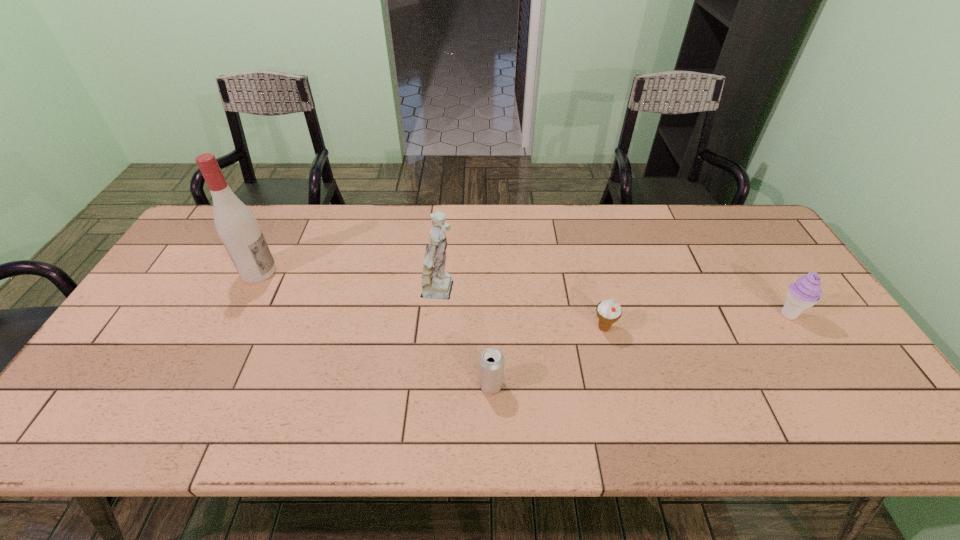
You are a GUI agent. You are given a task and a screenshot of the screen. Output one action in this format:
    pyautogui.click(x=<x>, y=<y>)
    Task: Click on the alcohol
    
    Given the screenshot: What is the action you would take?
    pyautogui.click(x=236, y=225)

At what (x,y) coordinates should I click in order to perform the action: click on the tallest object. Please return your answer as a coordinate pair (x, y). Looking at the image, I should click on (236, 225).

Locate an element on the screen. This screenshot has width=960, height=540. the fourth object from right to left is located at coordinates (437, 284).

Find the location of `figurine`. figurine is located at coordinates (437, 284).

The image size is (960, 540). I want to click on the rightmost object, so click(806, 291).

This screenshot has height=540, width=960. In order to click on the third shortest object in this screenshot , I will do `click(806, 291)`.

You are a GUI agent. You are given a task and a screenshot of the screen. Output one action in this format:
    pyautogui.click(x=<x>, y=<y>)
    Task: Click on the left icecream
    The image size is (960, 540).
    Given the screenshot: What is the action you would take?
    pyautogui.click(x=608, y=311)

Find the location of a particular element. the second object from right to left is located at coordinates (608, 311).

Where is `beer can`? This screenshot has width=960, height=540. beer can is located at coordinates (491, 361).

Find the location of a particular element. The width and height of the screenshot is (960, 540). the third object from right to left is located at coordinates (491, 361).